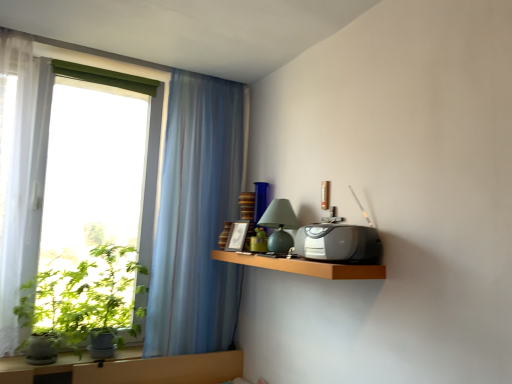
The height and width of the screenshot is (384, 512). Describe the element at coordinates (196, 219) in the screenshot. I see `translucent blue curtain at upper left` at that location.

The image size is (512, 384). In order to click on transparent glass window at left in this screenshot , I will do `click(196, 219)`.

The height and width of the screenshot is (384, 512). What are the coordinates of `green leafy plant at left` in the screenshot? It's located at pyautogui.click(x=84, y=298).

I want to click on matte green glass table lamp at center, so click(x=279, y=225).

Find the location of a particular element. The image size is (512, 384). translucent blue curtain at upper left is located at coordinates (196, 219).

Does point (184, 346) appear closer or farther from the camera than point (183, 216)?

Point (184, 346).

Image resolution: width=512 pixels, height=384 pixels. Find the location of `window in front of the translucent blue curtain at upper left`. window in front of the translucent blue curtain at upper left is located at coordinates (196, 219).

Would you say translucent blue curtain at upper left is to the left or to the right of transparent glass window at left in the picture?

In the image, translucent blue curtain at upper left appears on the right side of transparent glass window at left.

Considering the relative sizes of translucent blue curtain at upper left and transparent glass window at left in the image provided, is translucent blue curtain at upper left shorter than transparent glass window at left?

No.

Is satin black radio at upper right shorter than matte green glass table lamp at center?

Indeed, satin black radio at upper right has a lesser height compared to matte green glass table lamp at center.

Is satin black radio at upper right facing away from matte green glass table lamp at center?

No, satin black radio at upper right is not facing away from matte green glass table lamp at center.

Is there a large distance between satin black radio at upper right and matte green glass table lamp at center?

No.

How distant is satin black radio at upper right from matte green glass table lamp at center?

satin black radio at upper right and matte green glass table lamp at center are 14.70 inches apart.

Which object is closer to the camera taking this photo, transparent glass window at left or satin black radio at upper right?

satin black radio at upper right.

Between point (219, 146) and point (348, 245), which one is positioned in front?

The point (348, 245) is closer to the camera.

In the image, there is a transparent glass window at left. Where is `appliance below it (from a real-world perspective)`? This screenshot has width=512, height=384. appliance below it (from a real-world perspective) is located at coordinates (339, 243).

Can you confirm if transparent glass window at left is bigger than satin black radio at upper right?

Indeed, transparent glass window at left has a larger size compared to satin black radio at upper right.

Is the depth of translucent blue curtain at upper left greater than that of wooden shelf at upper right?

Yes, translucent blue curtain at upper left is further from the viewer.

Can you confirm if translucent blue curtain at upper left is bigger than wooden shelf at upper right?

Yes, translucent blue curtain at upper left is bigger than wooden shelf at upper right.

Where is `shelf below the translucent blue curtain at upper left (from a real-world perspective)`? This screenshot has height=384, width=512. shelf below the translucent blue curtain at upper left (from a real-world perspective) is located at coordinates (304, 266).

Is translucent blue curtain at upper left wider or thinner than wooden shelf at upper right?

In the image, translucent blue curtain at upper left appears to be more narrow than wooden shelf at upper right.

Does point (56, 297) appear closer or farther from the camera than point (289, 237)?

Clearly, point (56, 297) is more distant from the camera than point (289, 237).

Between green leafy plant at left and matte green glass table lamp at center, which one has less height?

matte green glass table lamp at center is shorter.

Would you say green leafy plant at left contains matte green glass table lamp at center?

No, green leafy plant at left does not contain matte green glass table lamp at center.

You are a GUI agent. You are given a task and a screenshot of the screen. Output one action in this format:
    pyautogui.click(x=<x>, y=<y>)
    Task: Click on the table lamp above the green leafy plant at left (from the image's perspective)
    This screenshot has height=384, width=512.
    Given the screenshot: What is the action you would take?
    pyautogui.click(x=279, y=225)

From the image's perspective, is green leafy plant at left located above satin black radio at upper right?

No, from the image's perspective, green leafy plant at left is not above satin black radio at upper right.

This screenshot has height=384, width=512. Find the location of `appliance in front of the green leafy plant at left`. appliance in front of the green leafy plant at left is located at coordinates (339, 243).

Measure the distance from green leafy plant at left to satin black radio at upper right.

They are 1.33 meters apart.

Which is closer, (84, 307) or (369, 233)?

The point (369, 233) is in front.

Can translucent blue curtain at upper left be found inside wooden shelf at upper right?

Definitely not — translucent blue curtain at upper left is not inside wooden shelf at upper right.

Does wooden shelf at upper right have a greater width compared to translucent blue curtain at upper left?

Yes, wooden shelf at upper right is wider than translucent blue curtain at upper left.

Which is more to the right, wooden shelf at upper right or translucent blue curtain at upper left?

From the viewer's perspective, wooden shelf at upper right appears more on the right side.

Is point (338, 277) closer to viewer compared to point (199, 191)?

That is True.

The height and width of the screenshot is (384, 512). I want to click on curtain below the transparent glass window at left (from the image's perspective), so click(196, 219).

Find the location of a particular element. This screenshot has height=384, width=512. appliance in front of the matte green glass table lamp at center is located at coordinates 339,243.

Which object lies further to the anchor point transparent glass window at left, translucent blue curtain at upper left or green leafy plant at left?

The object further to transparent glass window at left is green leafy plant at left.

Based on the photo, based on their spatial positions, is wooden shelf at upper right or translucent blue curtain at upper left further from green leafy plant at left?

The object further to green leafy plant at left is wooden shelf at upper right.

Which object lies further to the anchor point wooden shelf at upper right, satin black radio at upper right or matte green glass table lamp at center?

Based on the image, matte green glass table lamp at center appears to be further to wooden shelf at upper right.

Looking at the image, which one is located closer to transparent glass window at left, matte green glass table lamp at center or satin black radio at upper right?

matte green glass table lamp at center lies closer to transparent glass window at left than the other object.

Considering their positions, is translucent blue curtain at upper left positioned further to green leafy plant at left than wooden shelf at upper right?

wooden shelf at upper right lies further to green leafy plant at left than the other object.

Looking at the image, which one is located further to translucent blue curtain at upper left, transparent glass window at left or wooden shelf at upper right?

wooden shelf at upper right is positioned further to the anchor translucent blue curtain at upper left.

From the image, which object appears to be farther from matte green glass table lamp at center, wooden shelf at upper right or transparent glass window at left?

transparent glass window at left.

Estimate the real-world distances between objects in this image. Which object is further from translucent blue curtain at upper left, matte green glass table lamp at center or satin black radio at upper right?

satin black radio at upper right is further to translucent blue curtain at upper left.

Where is `table lamp between green leafy plant at left and satin black radio at upper right in the horizontal direction`? table lamp between green leafy plant at left and satin black radio at upper right in the horizontal direction is located at coordinates (279, 225).

You are a GUI agent. You are given a task and a screenshot of the screen. Output one action in this format:
    pyautogui.click(x=<x>, y=<y>)
    Task: Click on the table lamp situated between green leafy plant at left and wooden shelf at upper right from left to right
    The image size is (512, 384).
    Given the screenshot: What is the action you would take?
    pyautogui.click(x=279, y=225)

Find the location of a particular element. Image resolution: width=512 pixels, height=384 pixels. shelf between transparent glass window at left and satin black radio at upper right in the horizontal direction is located at coordinates (x=304, y=266).

Locate an element on the screen. The image size is (512, 384). curtain between transparent glass window at left and wooden shelf at upper right from left to right is located at coordinates (196, 219).